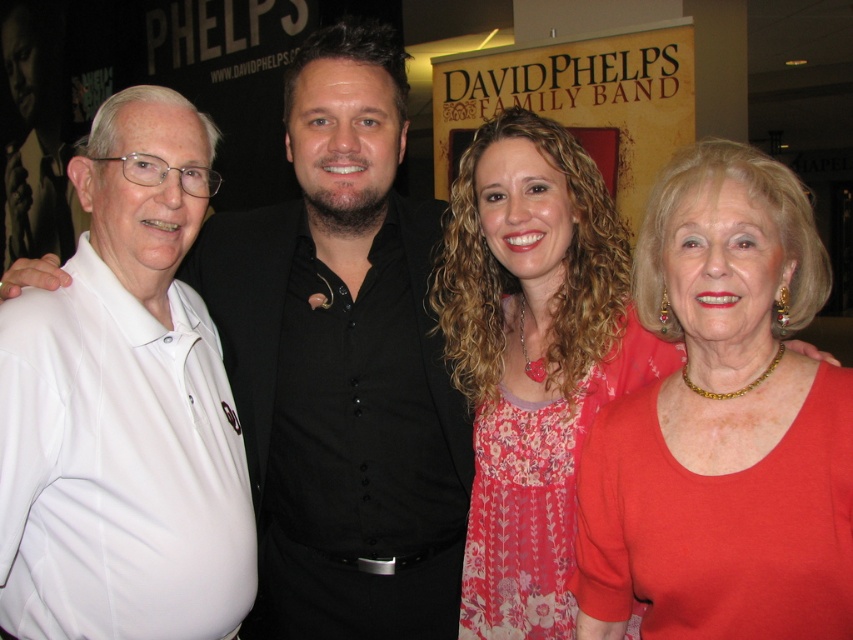
Question: Does matte gold necklace at center have a larger size compared to floral dress at center?

Choices:
 (A) yes
 (B) no

Answer: (A)

Question: Estimate the real-world distances between objects in this image. Which object is closer to the white cotton polo shirt at left?

Choices:
 (A) white matte shirt at left
 (B) matte gold necklace at center

Answer: (A)

Question: Is white matte shirt at left above floral dress at center?

Choices:
 (A) no
 (B) yes

Answer: (B)

Question: Is white matte shirt at left closer to the viewer compared to floral dress at center?

Choices:
 (A) yes
 (B) no

Answer: (B)

Question: Which of these objects is positioned farthest from the floral dress at center?

Choices:
 (A) matte gold necklace at center
 (B) white cotton polo shirt at left
 (C) white matte shirt at left

Answer: (B)

Question: Which point is farther to the camera?

Choices:
 (A) (328, 74)
 (B) (715, 468)
 (C) (572, 157)
 (D) (114, 220)

Answer: (A)